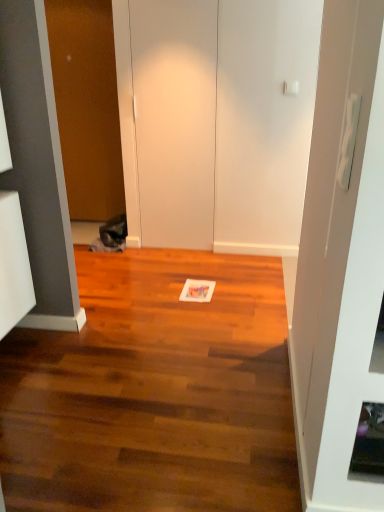
Question: From the image's perspective, is white matte door at center, marked as the 1th door in a right-to-left arrangement, positioned above or below wooden door at left, placed as the first door when sorted from left to right?

Choices:
 (A) below
 (B) above

Answer: (A)

Question: Based on their positions, is white matte door at center, marked as the 1th door in a right-to-left arrangement, located to the left or right of wooden door at left, placed as the first door when sorted from left to right?

Choices:
 (A) right
 (B) left

Answer: (A)

Question: In terms of height, does white matte door at center, marked as the 1th door in a right-to-left arrangement, look taller or shorter compared to wooden door at left, which is counted as the 2th door, starting from the right?

Choices:
 (A) tall
 (B) short

Answer: (B)

Question: Is wooden door at left, which is counted as the 2th door, starting from the right, in front of or behind white matte door at center, the second door positioned from the left, in the image?

Choices:
 (A) front
 (B) behind

Answer: (B)

Question: Considering the positions of wooden door at left, placed as the first door when sorted from left to right, and white matte door at center, the second door positioned from the left, in the image, is wooden door at left, placed as the first door when sorted from left to right, wider or thinner than white matte door at center, the second door positioned from the left,?

Choices:
 (A) thin
 (B) wide

Answer: (B)

Question: Visually, is wooden door at left, placed as the first door when sorted from left to right, positioned to the left or to the right of white matte door at center, the second door positioned from the left?

Choices:
 (A) left
 (B) right

Answer: (A)

Question: From the image's perspective, is wooden door at left, placed as the first door when sorted from left to right, located above or below white matte door at center, the second door positioned from the left?

Choices:
 (A) below
 (B) above

Answer: (B)